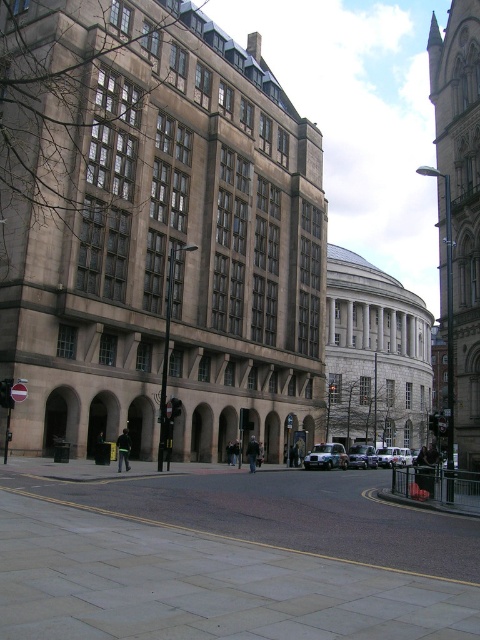
Is metallic silver car at center to the right of white matte van at center from the viewer's perspective?

Incorrect, metallic silver car at center is not on the right side of white matte van at center.

The height and width of the screenshot is (640, 480). Describe the element at coordinates (326, 456) in the screenshot. I see `metallic silver car at center` at that location.

Is point (322, 464) less distant than point (408, 452)?

Yes, it is.

Identify the location of metallic silver car at center. The image size is (480, 640). (326, 456).

Looking at this image, is metallic silver car at center bigger than silver metallic car at center?

No, metallic silver car at center is not bigger than silver metallic car at center.

Who is more forward, (321, 454) or (360, 444)?

Point (321, 454) is more forward.

Image resolution: width=480 pixels, height=640 pixels. Find the location of `metallic silver car at center`. metallic silver car at center is located at coordinates (326, 456).

Between point (408, 461) and point (376, 460), which one is positioned in front?

Point (376, 460) is more forward.

Does white matte van at center lie in front of silver metallic car at center?

No, it is not.

Locate an element on the screen. Image resolution: width=480 pixels, height=640 pixels. white matte van at center is located at coordinates (394, 456).